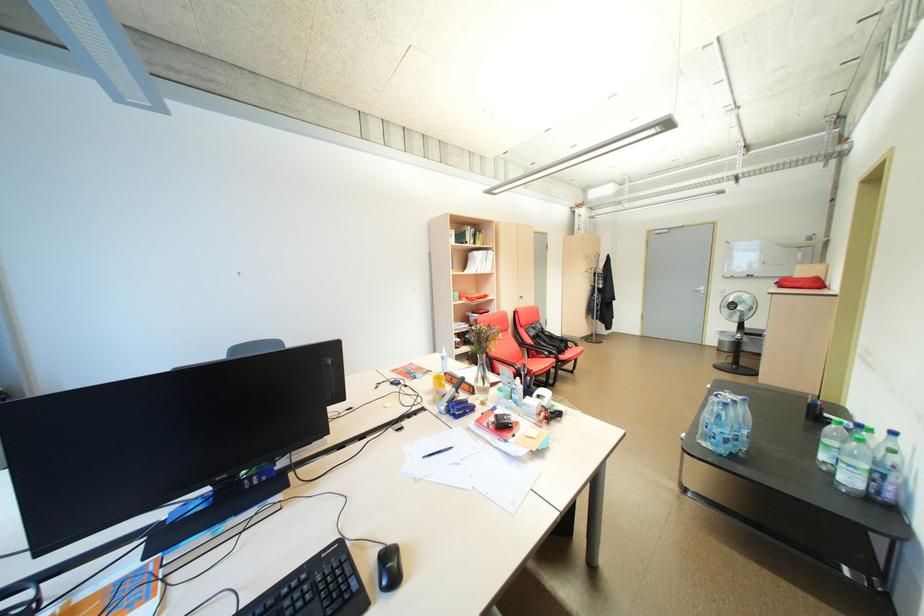
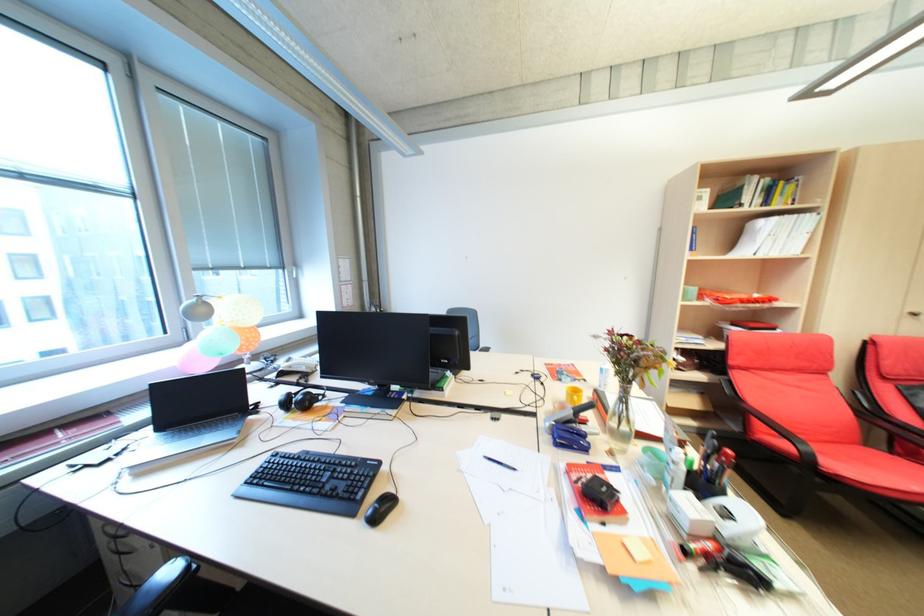
Find the pixel in the second image that matches [485,379] in the first image.

(623, 416)